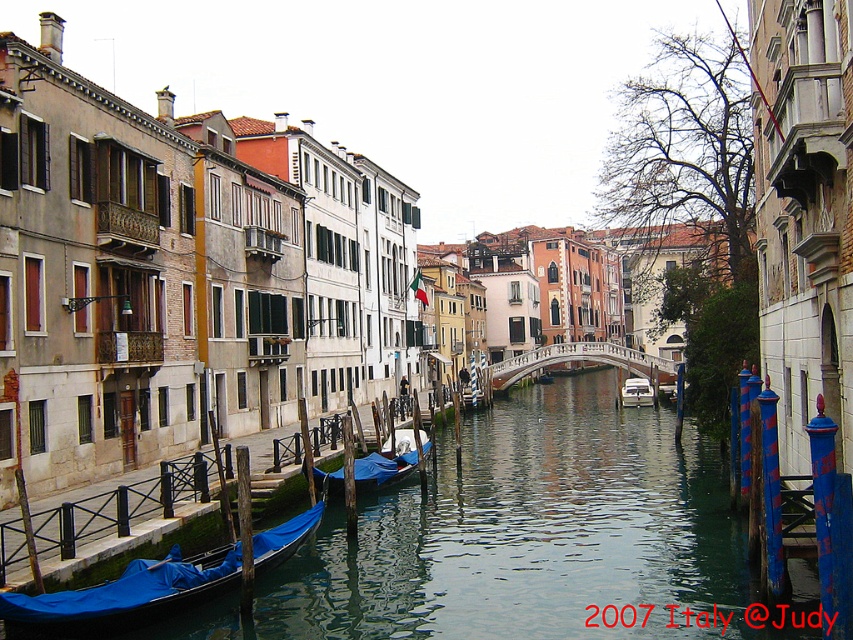
Question: Can you confirm if blue fabric-covered gondola at lower left is wider than white glossy boat at center?

Choices:
 (A) no
 (B) yes

Answer: (B)

Question: Considering the relative positions of blue fabric-covered gondola at center and white stone bridge at center in the image provided, where is blue fabric-covered gondola at center located with respect to white stone bridge at center?

Choices:
 (A) above
 (B) below

Answer: (B)

Question: Is white stone bridge at center closer to the viewer compared to blue tarp-covered gondola at center?

Choices:
 (A) yes
 (B) no

Answer: (B)

Question: Which point is farther to the camera?

Choices:
 (A) white glossy boat at center
 (B) white stone bridge at center
 (C) blue fabric-covered gondola at center

Answer: (B)

Question: Which object is the farthest from the white glossy boat at center?

Choices:
 (A) white stone bridge at center
 (B) blue fabric-covered gondola at lower left

Answer: (B)

Question: Which of the following is the closest to the observer?

Choices:
 (A) (624, 356)
 (B) (294, 518)
 (C) (630, 380)
 (D) (138, 544)

Answer: (D)